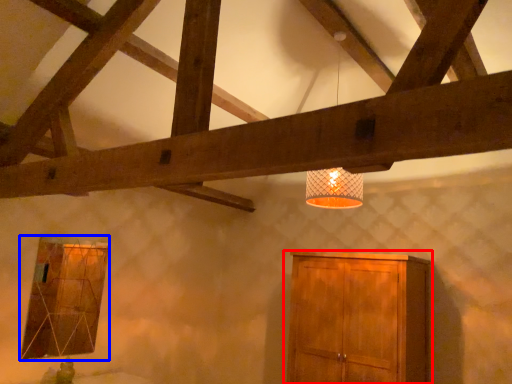
Question: Which of the following is the farthest to the observer, cupboard (highlighted by a red box) or window (highlighted by a blue box)?

Choices:
 (A) cupboard
 (B) window

Answer: (B)